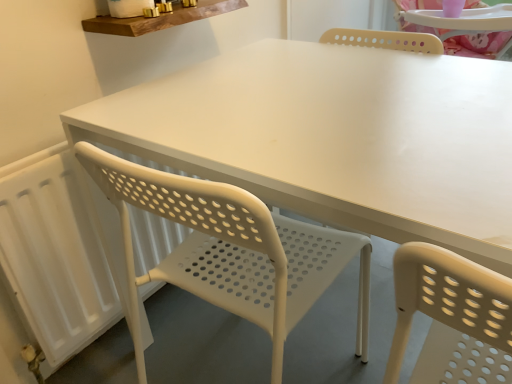
Question: Is white perforated plastic chair at center wider than white matte radiator at left?

Choices:
 (A) yes
 (B) no

Answer: (A)

Question: Is the depth of white perforated plastic chair at center greater than that of white matte radiator at left?

Choices:
 (A) yes
 (B) no

Answer: (B)

Question: Does white perforated plastic chair at center have a lesser width compared to white matte radiator at left?

Choices:
 (A) no
 (B) yes

Answer: (A)

Question: Would you say white perforated plastic chair at center is outside white matte radiator at left?

Choices:
 (A) yes
 (B) no

Answer: (A)

Question: From a real-world perspective, is white perforated plastic chair at center over white matte radiator at left?

Choices:
 (A) yes
 (B) no

Answer: (A)

Question: Is white perforated plastic chair at center positioned with its back to white matte radiator at left?

Choices:
 (A) yes
 (B) no

Answer: (B)

Question: Is white matte radiator at left touching wooden shelf at upper center?

Choices:
 (A) yes
 (B) no

Answer: (B)

Question: Can you confirm if white matte radiator at left is bigger than wooden shelf at upper center?

Choices:
 (A) yes
 (B) no

Answer: (A)

Question: Is white matte radiator at left aimed at wooden shelf at upper center?

Choices:
 (A) no
 (B) yes

Answer: (A)

Question: Does white matte radiator at left come behind wooden shelf at upper center?

Choices:
 (A) no
 (B) yes

Answer: (A)

Question: From the image's perspective, does white matte radiator at left appear higher than wooden shelf at upper center?

Choices:
 (A) no
 (B) yes

Answer: (A)

Question: From a real-world perspective, is white matte radiator at left positioned under wooden shelf at upper center based on gravity?

Choices:
 (A) no
 (B) yes

Answer: (B)

Question: Is wooden shelf at upper center beside white perforated plastic chair at center?

Choices:
 (A) no
 (B) yes

Answer: (A)